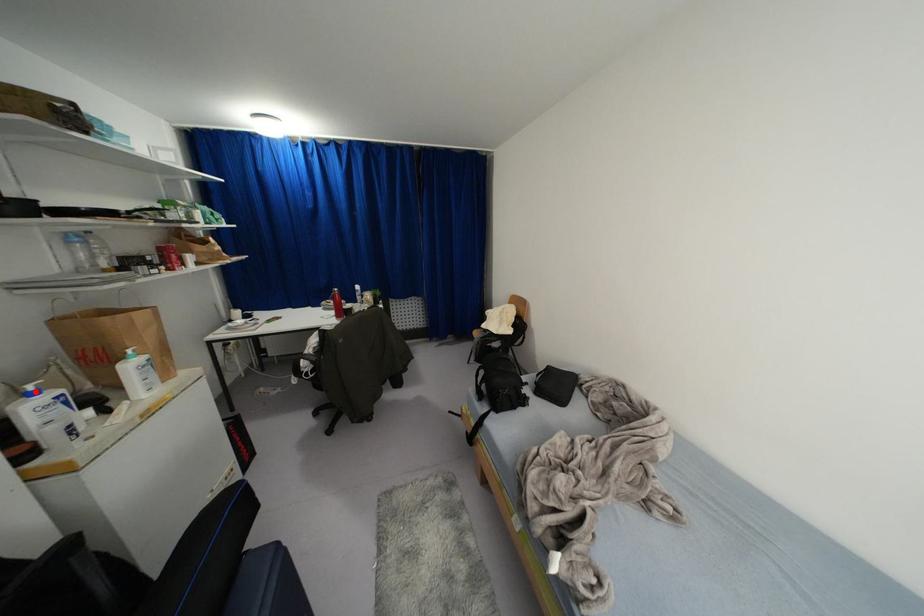
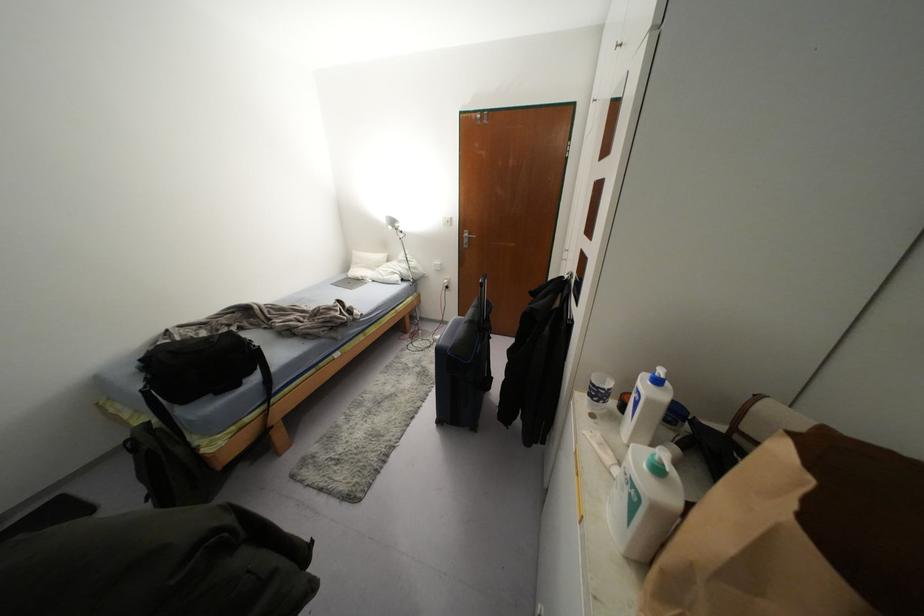
Where in the second image is the point corresponding to the highlighted location from the first image?

(658, 381)